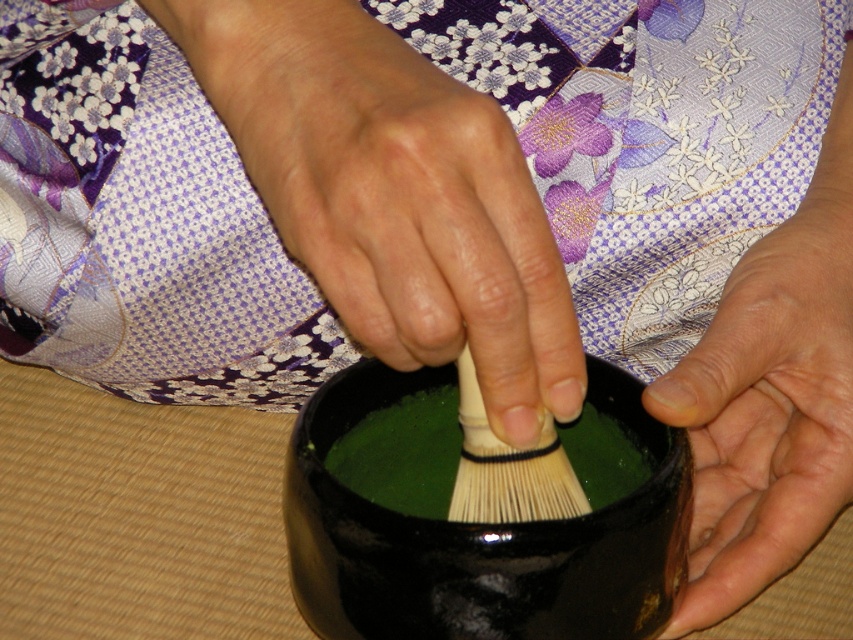
Question: Which of the following is the farthest from the observer?

Choices:
 (A) black glossy bowl at center
 (B) white bristle brush at center
 (C) smooth skin palm at lower right

Answer: (C)

Question: Does black glossy bowl at center come behind white bristle brush at center?

Choices:
 (A) no
 (B) yes

Answer: (A)

Question: Which object appears farthest from the camera in this image?

Choices:
 (A) black glossy bowl at center
 (B) smooth beige brush at center
 (C) white bristle brush at center

Answer: (C)

Question: Which point appears closest to the camera in this image?

Choices:
 (A) (454, 492)
 (B) (793, 356)
 (C) (281, 38)
 (D) (389, 531)

Answer: (C)

Question: Does smooth skin palm at lower right appear on the right side of white bristle brush at center?

Choices:
 (A) yes
 (B) no

Answer: (A)

Question: Where is black glossy bowl at center located in relation to white bristle brush at center in the image?

Choices:
 (A) above
 (B) below

Answer: (B)